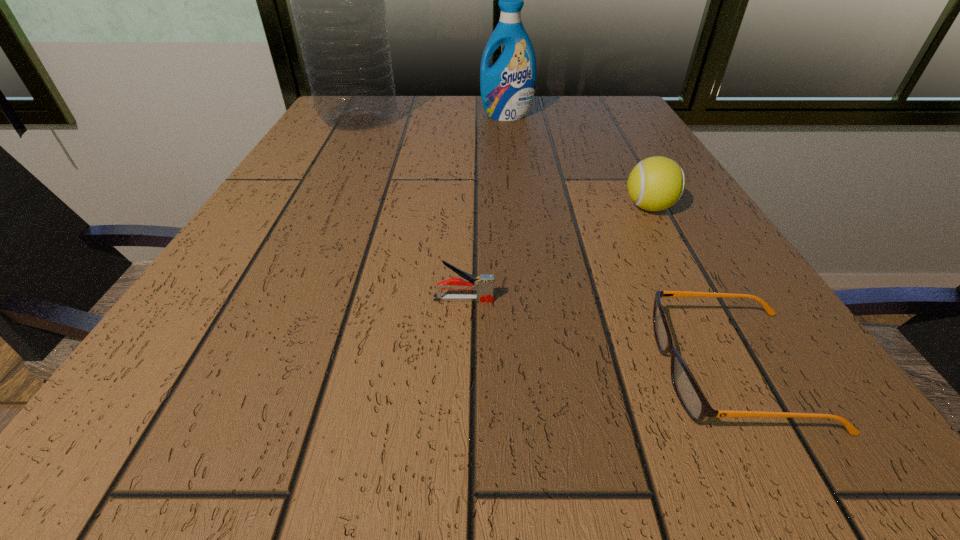
Where is `tennis ball at the right edge`? tennis ball at the right edge is located at coordinates (656, 183).

You are a GUI agent. You are given a task and a screenshot of the screen. Output one action in this format:
    pyautogui.click(x=<x>, y=<y>)
    Task: Click on the spectacles that is at the right edge
    The image size is (960, 540).
    Given the screenshot: What is the action you would take?
    pyautogui.click(x=694, y=403)

The image size is (960, 540). What are the coordinates of `object at the far left corner` in the screenshot? It's located at (337, 0).

What are the coordinates of `object at the near right corner` in the screenshot? It's located at (694, 403).

In the image, there is a desktop. At what (x,y) coordinates should I click in order to perform the action: click on free space at the far edge. Please return your answer as a coordinate pair (x, y). The image size is (960, 540). Looking at the image, I should click on (459, 104).

Locate an element on the screen. The height and width of the screenshot is (540, 960). vacant space at the left edge of the desktop is located at coordinates (301, 216).

Locate an element on the screen. free space at the near left corner is located at coordinates click(187, 404).

The image size is (960, 540). In the image, there is a desktop. In order to click on vacant area at the far right corner in this screenshot , I will do `click(620, 96)`.

I want to click on free area in between the stapler and the shortest object, so click(x=599, y=334).

Find the location of a particular element. unoccupied position between the leftmost object and the second nearest object is located at coordinates (411, 209).